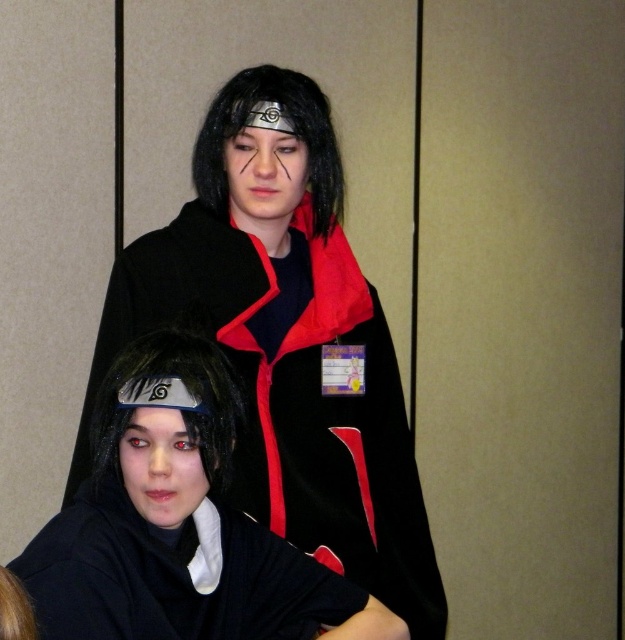
You are a photographer setting up a photoshoot for a cosplay event. You need to ensure that the velvet black cape at upper center and the black velvet robe at lower center are positioned correctly. Based on the scene description, which object is located higher in the image?

The velvet black cape at upper center is positioned higher in the image than the black velvet robe at lower center.